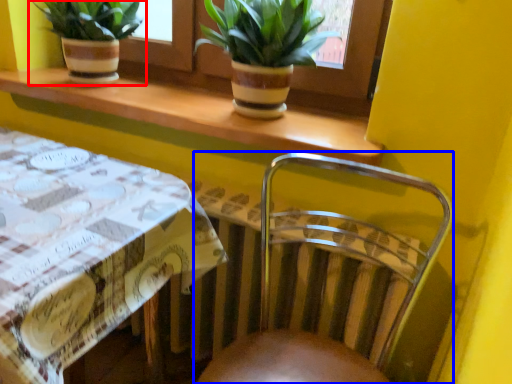
Question: Which object is closer to the camera taking this photo, houseplant (highlighted by a red box) or chair (highlighted by a blue box)?

Choices:
 (A) houseplant
 (B) chair

Answer: (B)